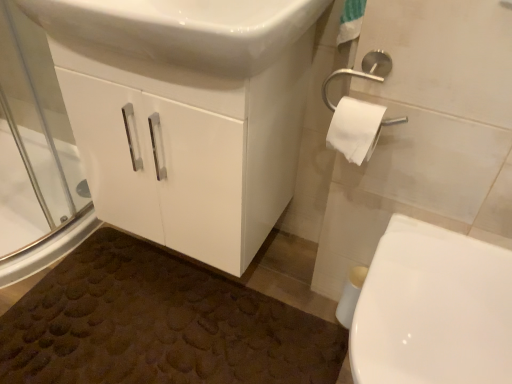
Question: From the image's perspective, is white glossy cabinet at center located above or below transparent glass screen door at left?

Choices:
 (A) below
 (B) above

Answer: (A)

Question: Is white glossy cabinet at center to the left or to the right of transparent glass screen door at left in the image?

Choices:
 (A) right
 (B) left

Answer: (A)

Question: Which object is the closest to the white glossy toilet at lower right?

Choices:
 (A) white glossy sink at upper center
 (B) transparent glass screen door at left
 (C) brown textured bath mat at lower left
 (D) white matte toilet paper at right
 (E) white glossy cabinet at center

Answer: (D)

Question: Based on their relative distances, which object is farther from the brown textured bath mat at lower left?

Choices:
 (A) white glossy cabinet at center
 (B) white matte toilet paper at right
 (C) white glossy toilet at lower right
 (D) transparent glass screen door at left
 (E) white glossy sink at upper center

Answer: (E)